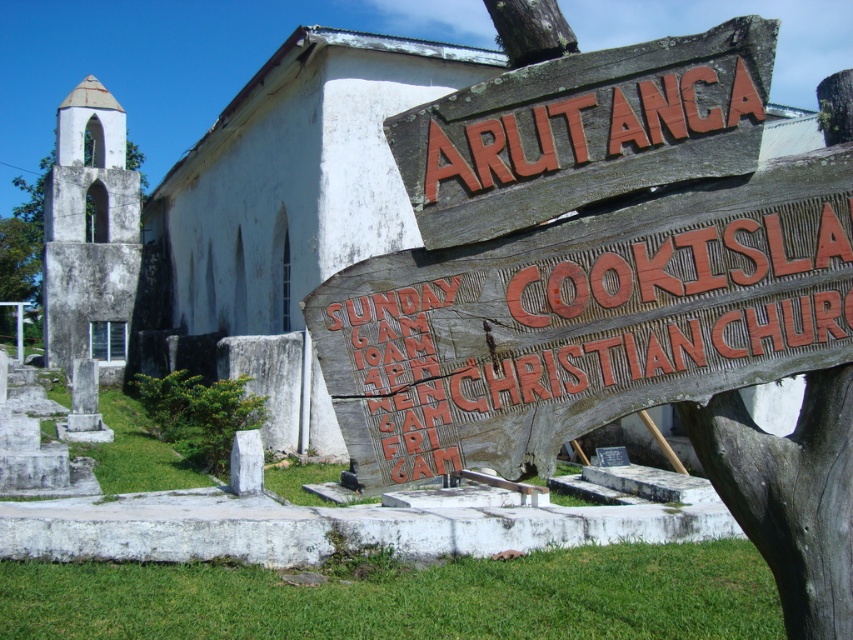
Does point (770, 51) come closer to viewer compared to point (107, 273)?

Yes, it is.

Is wooden sign at upper center taller than white stone chapel at left?

No.

Is point (567, 132) positioned before point (45, 221)?

Yes, point (567, 132) is in front of point (45, 221).

Identify the location of wooden sign at upper center. The width and height of the screenshot is (853, 640). (584, 131).

Does point (628, 228) come behind point (47, 314)?

No, (628, 228) is closer to viewer.

What are the coordinates of `weathered wood sign at center` in the screenshot? It's located at (585, 321).

Where is `weathered wood sign at center`? weathered wood sign at center is located at coordinates (585, 321).

In the scene shown: Does weathered wood sign at center have a lesser width compared to wooden sign at upper center?

No.

Can you confirm if weathered wood sign at center is wider than wooden sign at upper center?

Yes, weathered wood sign at center is wider than wooden sign at upper center.

Who is more distant from viewer, (413, 406) or (733, 141)?

Point (733, 141)

You are a GUI agent. You are given a task and a screenshot of the screen. Output one action in this format:
    pyautogui.click(x=<x>, y=<y>)
    Task: Click on the weathered wood sign at center
    The width and height of the screenshot is (853, 640).
    Given the screenshot: What is the action you would take?
    (x=585, y=321)